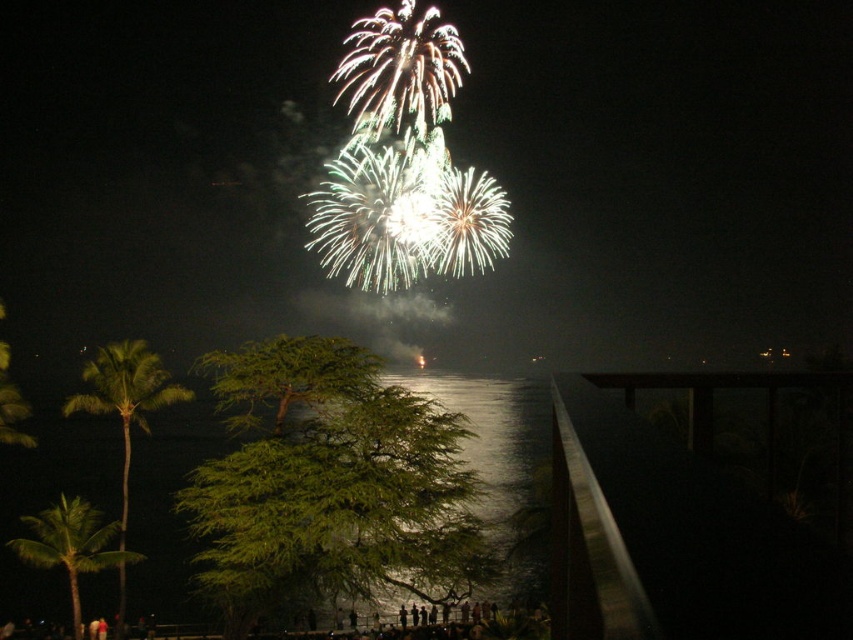
Question: Does green leafy palm tree at left appear on the left side of green leafy palm tree at lower left?

Choices:
 (A) yes
 (B) no

Answer: (A)

Question: Does green leafy palm tree at left lie behind green leafy palm tree at lower left?

Choices:
 (A) no
 (B) yes

Answer: (B)

Question: Which of the following is the farthest from the observer?

Choices:
 (A) (108, 396)
 (B) (505, 548)

Answer: (B)

Question: Which object is positioned farthest from the glistening metallic water at center?

Choices:
 (A) green leafy palm tree at lower left
 (B) green leafy palm tree at left

Answer: (B)

Question: Is glistening metallic water at center smaller than green leafy palm tree at lower left?

Choices:
 (A) no
 (B) yes

Answer: (A)

Question: Which object is the closest to the glistening metallic water at center?

Choices:
 (A) green leafy palm tree at left
 (B) green leafy palm tree at lower left

Answer: (B)